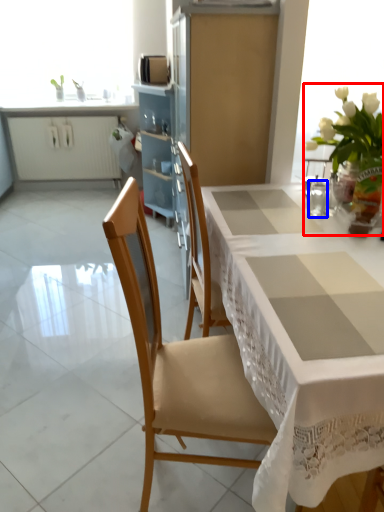
Question: Which object appears closest to the camera in this image, floral arrangement (highlighted by a red box) or tableware (highlighted by a blue box)?

Choices:
 (A) floral arrangement
 (B) tableware

Answer: (A)